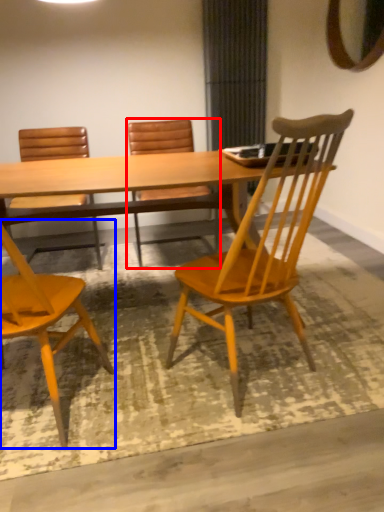
Question: Which object appears closest to the camera in this image, chair (highlighted by a red box) or chair (highlighted by a blue box)?

Choices:
 (A) chair
 (B) chair

Answer: (B)